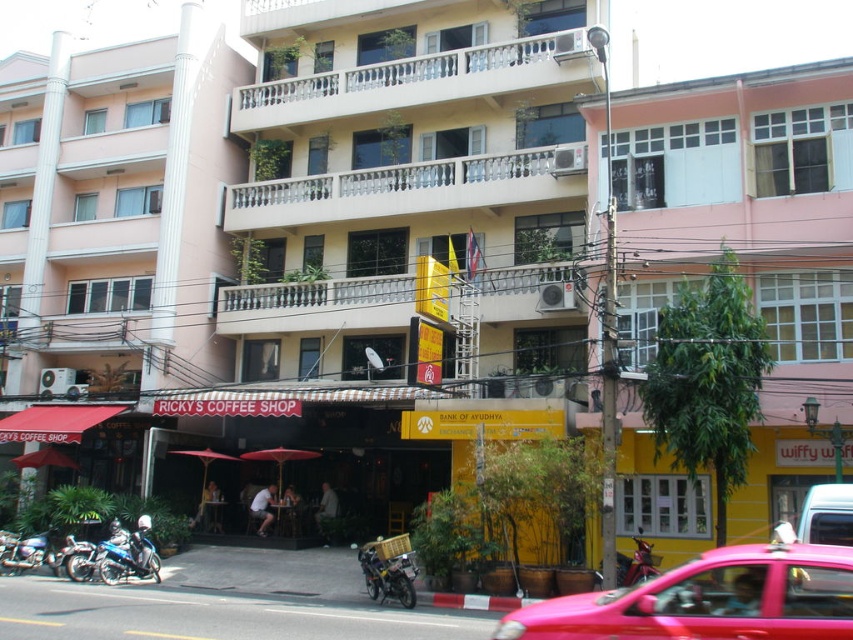
You are a pedestrian standing on the street and want to enter the pink matte building at center. Is the metallic pink taxi at center blocking your path to the entrance?

The pink matte building at center is located above the metallic pink taxi at center, so the taxi is not blocking the path to the entrance.

You are standing at the origin point of the coordinate system. Which direction should you move to reach the pink matte building at center?

The pink matte building at center is located at coordinate point 0.378 on the x axis and 0.877 on the y axis. Since the origin is at the bottom left corner, moving towards the right and upwards will lead you to the pink matte building at center.

You are a photographer wanting to capture both the pink matte building at center and the metallic pink taxi at center in a single frame. Since you want the taxi to appear smaller relative to the building in the photo, where should you position yourself in relation to them?

To make the metallic pink taxi at center appear smaller than the pink matte building at center in the photo, you should position yourself closer to the pink matte building at center. Since the pink matte building at center is taller than the metallic pink taxi at center, moving closer to the building will make it dominate the frame, making the taxi seem smaller in comparison.